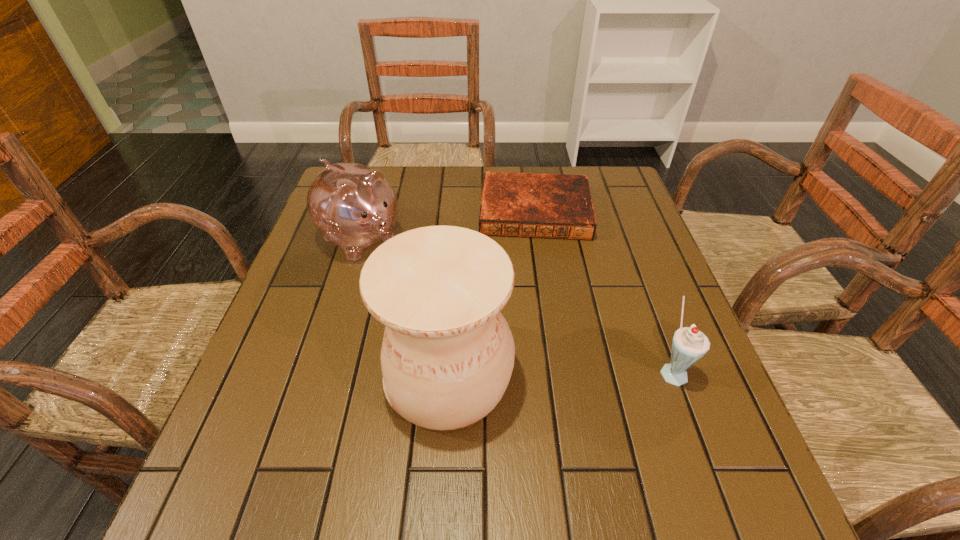
Where is `vacant region located 0.060m on the spine side of the Bible`? vacant region located 0.060m on the spine side of the Bible is located at coordinates (536, 256).

Where is `free space located on the spine side of the Bible`? free space located on the spine side of the Bible is located at coordinates (537, 293).

What are the coordinates of `free space located on the front facing side of the leftmost object` in the screenshot? It's located at 404,271.

The width and height of the screenshot is (960, 540). What are the coordinates of `free region located on the front facing side of the leftmost object` in the screenshot? It's located at (501, 346).

You are a GUI agent. You are given a task and a screenshot of the screen. Output one action in this format:
    pyautogui.click(x=<x>, y=<y>)
    Task: Click on the blank space located on the front facing side of the leftmost object
    This screenshot has height=540, width=960.
    Given the screenshot: What is the action you would take?
    pyautogui.click(x=480, y=330)

What are the coordinates of `object present at the far edge` in the screenshot? It's located at (555, 206).

Locate an element on the screen. The height and width of the screenshot is (540, 960). object that is at the near edge is located at coordinates (447, 356).

Image resolution: width=960 pixels, height=540 pixels. I want to click on object positioned at the left edge, so click(x=353, y=206).

You are a GUI agent. You are given a task and a screenshot of the screen. Output one action in this format:
    pyautogui.click(x=<x>, y=<y>)
    Task: Click on the milkshake that is at the right edge
    
    Given the screenshot: What is the action you would take?
    pyautogui.click(x=689, y=344)

Locate an element on the screen. This screenshot has width=960, height=540. Bible that is at the right edge is located at coordinates (555, 206).